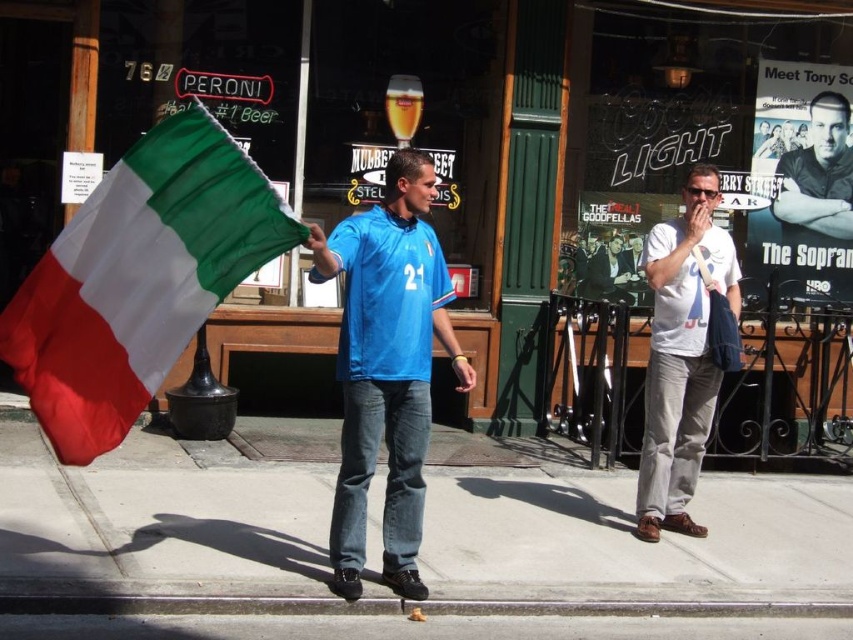
Based on the photo, you are a photographer trying to capture the smooth black shirt at center and the polyester fabric flag at left in the same frame. Based on their positions, which object will appear closer to the bottom of the photo?

The polyester fabric flag at left is positioned under the smooth black shirt at center, so it will appear closer to the bottom of the photo.